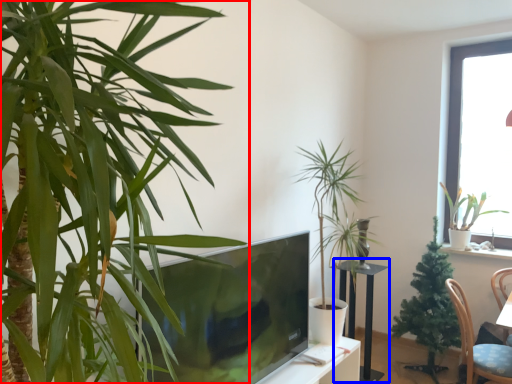
Question: Which of the following is the closest to the observer, houseplant (highlighted by a red box) or round table (highlighted by a blue box)?

Choices:
 (A) houseplant
 (B) round table

Answer: (A)